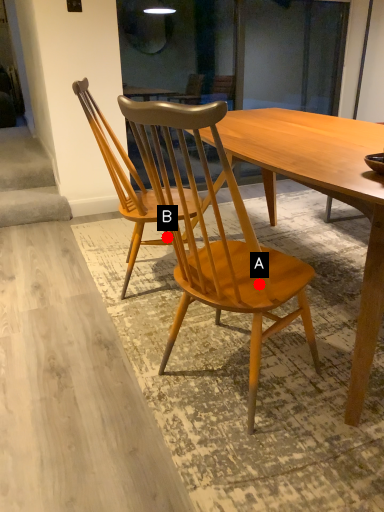
Question: Two points are circled on the image, labeled by A and B beside each circle. Which point is farther to the camera?

Choices:
 (A) A is further
 (B) B is further

Answer: (B)